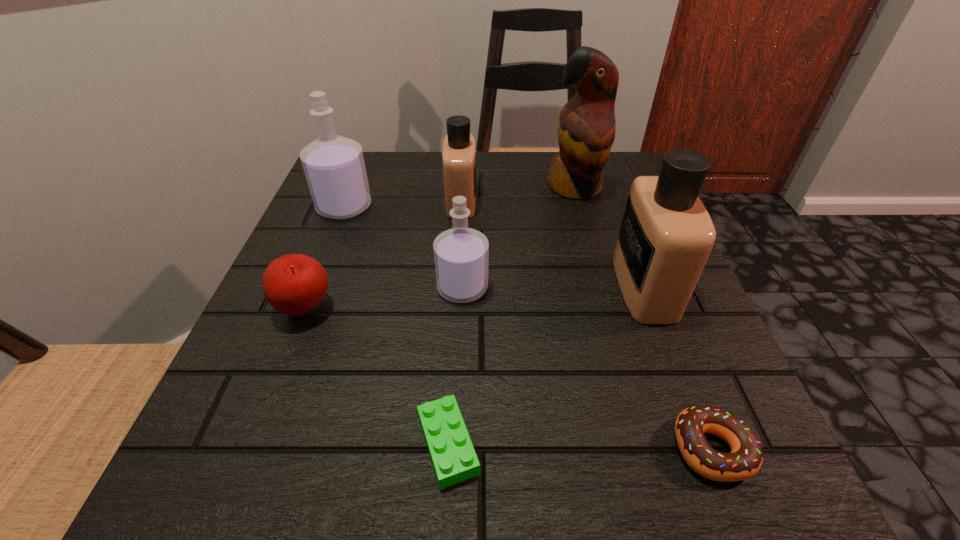
I want to click on free location located 0.110m on the front label of the bigger beige perfume, so click(554, 287).

Image resolution: width=960 pixels, height=540 pixels. Find the location of `vacant area situated 0.330m on the front label of the left beige perfume`. vacant area situated 0.330m on the front label of the left beige perfume is located at coordinates [630, 201].

I want to click on vacant region located 0.340m on the right of the right purple perfume, so click(687, 288).

The height and width of the screenshot is (540, 960). What are the coordinates of `vacant space situated on the back of the sixth tallest object` in the screenshot? It's located at pyautogui.click(x=327, y=254).

Where is `free space located on the left of the brown doughnut`? free space located on the left of the brown doughnut is located at coordinates (512, 448).

Identify the location of vacant space located 0.070m on the right of the shortest object. The image size is (960, 540). (537, 444).

Image resolution: width=960 pixels, height=540 pixels. In order to click on parrot located at the far edge in this screenshot , I will do `click(586, 127)`.

Find the location of a particular element. doughnut that is positioned at the near edge is located at coordinates (745, 460).

You are a GUI agent. You are given a task and a screenshot of the screen. Output one action in this format:
    pyautogui.click(x=<x>, y=<y>)
    Task: Click on the Lego that is at the near edge
    This screenshot has height=540, width=960.
    Given the screenshot: What is the action you would take?
    pyautogui.click(x=454, y=459)

Image resolution: width=960 pixels, height=540 pixels. Find the location of `perfume that is positioned at the left edge`. perfume that is positioned at the left edge is located at coordinates (334, 166).